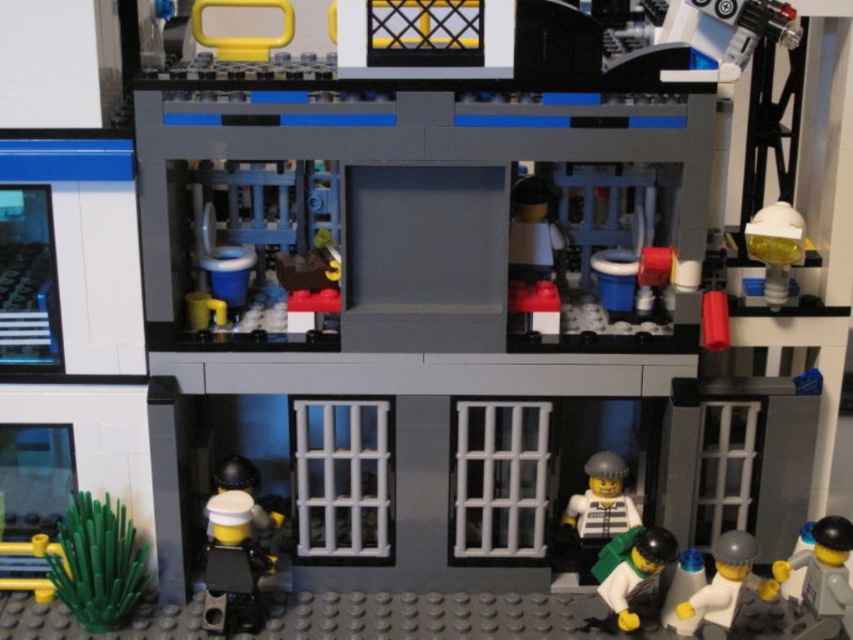
Question: Estimate the real-world distances between objects in this image. Which object is closer to the black plastic minifigure at lower left?

Choices:
 (A) smooth white figure at lower right
 (B) smooth white minifigure at lower right
 (C) shiny gold lamp at upper right

Answer: (B)

Question: Does light gray plastic minifigure at lower right have a smaller size compared to green matte minifigure at lower center?

Choices:
 (A) no
 (B) yes

Answer: (B)

Question: Which object is positioned farthest from the white matte minifigure at lower right?

Choices:
 (A) green matte minifigure at lower center
 (B) shiny gold lamp at upper right
 (C) light gray plastic minifigure at lower right
 (D) smooth white minifigure at lower right

Answer: (B)

Question: Which object is closer to the camera taking this photo?

Choices:
 (A) light gray plastic minifigure at lower right
 (B) black plastic minifigure at lower left
 (C) smooth white minifigure at lower right
 (D) white matte minifigure at lower right

Answer: (A)

Question: Does smooth white minifigure at lower right lie in front of white matte minifigure at lower right?

Choices:
 (A) no
 (B) yes

Answer: (A)

Question: Can you confirm if light gray plastic minifigure at lower right is positioned to the right of smooth white minifigure at lower right?

Choices:
 (A) no
 (B) yes

Answer: (B)